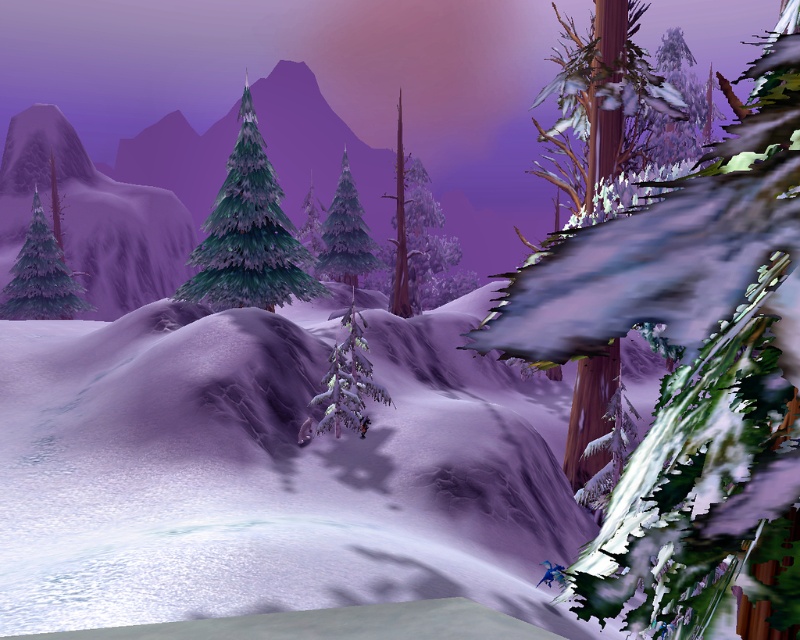
Question: Which object appears farthest from the camera in this image?

Choices:
 (A) snow-covered bark tree at right
 (B) green matte tree at center
 (C) green textured pine tree at center
 (D) snow-covered pine at upper right

Answer: (B)

Question: Which object appears farthest from the camera in this image?

Choices:
 (A) snow-covered pine tree at center
 (B) white frosty snow at center
 (C) snow-covered pine at center
 (D) shiny black snowboard at center

Answer: (A)

Question: Where is green textured pine tree at center located in relation to shiny black snowboard at center in the image?

Choices:
 (A) left
 (B) right

Answer: (A)

Question: Can you confirm if snow-covered bark tree at right is positioned below snow-covered pine tree at center?

Choices:
 (A) yes
 (B) no

Answer: (A)

Question: Which of the following is the closest to the observer?

Choices:
 (A) snow-covered pine at upper right
 (B) snow-covered pine at center
 (C) white frosty snow at center
 (D) blue plastic snowboard at lower right

Answer: (C)

Question: Is green textured pine tree at center to the left of blue plastic snowboard at lower right from the viewer's perspective?

Choices:
 (A) no
 (B) yes

Answer: (B)